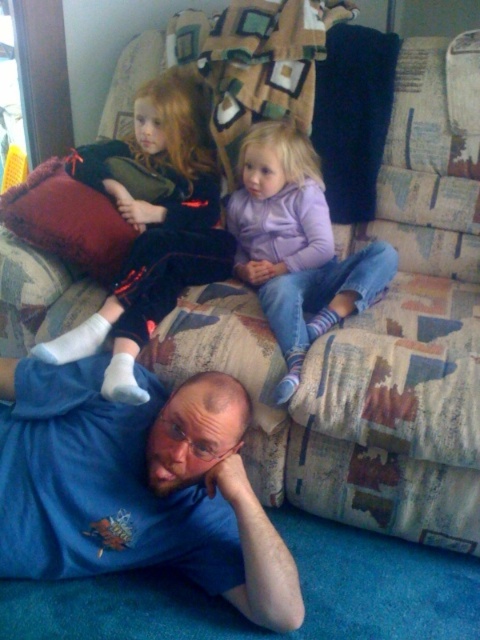
Which is above, blue t-shirt at lower left or purple fleece jacket at center?

Positioned higher is purple fleece jacket at center.

The width and height of the screenshot is (480, 640). I want to click on blue t-shirt at lower left, so click(x=134, y=484).

Is blue t-shirt at lower left positioned in front of velvet red pillow at upper left?

Yes, blue t-shirt at lower left is closer to the viewer.

Between blue t-shirt at lower left and velvet red pillow at upper left, which one is positioned lower?

blue t-shirt at lower left is below.

What are the coordinates of `blue t-shirt at lower left` in the screenshot? It's located at (134, 484).

The height and width of the screenshot is (640, 480). I want to click on blue t-shirt at lower left, so click(x=134, y=484).

Between blue t-shirt at lower left and matte black dress at upper left, which one has less height?

Standing shorter between the two is blue t-shirt at lower left.

Between point (32, 518) and point (190, 124), which one is positioned behind?

Point (190, 124)

Does point (219, 380) lie in front of point (67, 356)?

Yes, point (219, 380) is in front of point (67, 356).

The width and height of the screenshot is (480, 640). I want to click on blue t-shirt at lower left, so click(x=134, y=484).